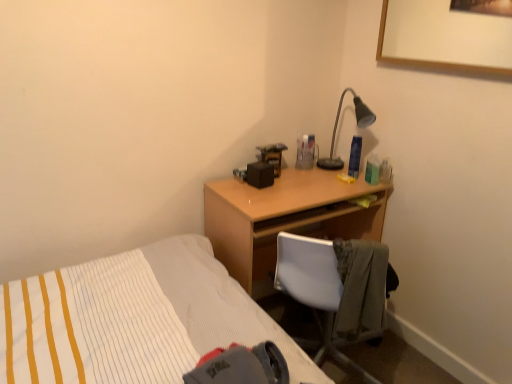
Question: From the image's perspective, is light brown wood desk at center on top of matte black desk lamp at upper right?

Choices:
 (A) yes
 (B) no

Answer: (B)

Question: Is light brown wood desk at center closer to camera compared to matte black desk lamp at upper right?

Choices:
 (A) no
 (B) yes

Answer: (B)

Question: Does light brown wood desk at center lie behind matte black desk lamp at upper right?

Choices:
 (A) no
 (B) yes

Answer: (A)

Question: Considering the relative sizes of light brown wood desk at center and matte black desk lamp at upper right in the image provided, is light brown wood desk at center smaller than matte black desk lamp at upper right?

Choices:
 (A) yes
 (B) no

Answer: (B)

Question: Is light brown wood desk at center aimed at matte black desk lamp at upper right?

Choices:
 (A) no
 (B) yes

Answer: (A)

Question: From a real-world perspective, is light brown wood desk at center on top of matte black desk lamp at upper right?

Choices:
 (A) no
 (B) yes

Answer: (A)

Question: Does matte black desk lamp at upper right turn towards light brown wood desk at center?

Choices:
 (A) no
 (B) yes

Answer: (A)

Question: From a real-world perspective, is matte black desk lamp at upper right positioned under light brown wood desk at center based on gravity?

Choices:
 (A) no
 (B) yes

Answer: (A)

Question: Does matte black desk lamp at upper right contain light brown wood desk at center?

Choices:
 (A) no
 (B) yes

Answer: (A)

Question: Is matte black desk lamp at upper right wider than light brown wood desk at center?

Choices:
 (A) no
 (B) yes

Answer: (A)

Question: From the image's perspective, is matte black desk lamp at upper right located above light brown wood desk at center?

Choices:
 (A) no
 (B) yes

Answer: (B)

Question: Considering the relative positions of matte black desk lamp at upper right and light brown wood desk at center in the image provided, is matte black desk lamp at upper right to the left of light brown wood desk at center from the viewer's perspective?

Choices:
 (A) yes
 (B) no

Answer: (B)

Question: Considering the relative sizes of light brown wood desk at center and white plastic chair at center in the image provided, is light brown wood desk at center taller than white plastic chair at center?

Choices:
 (A) yes
 (B) no

Answer: (A)